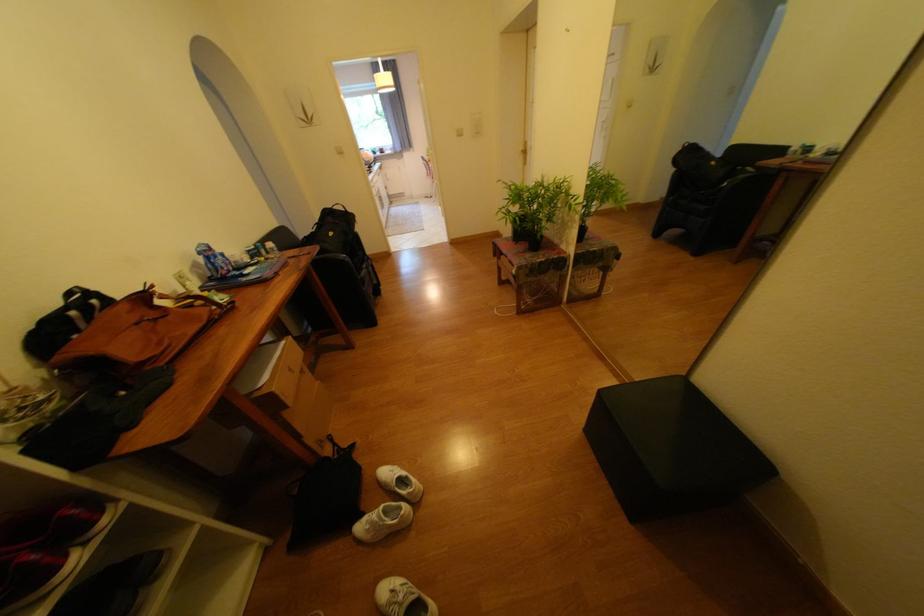
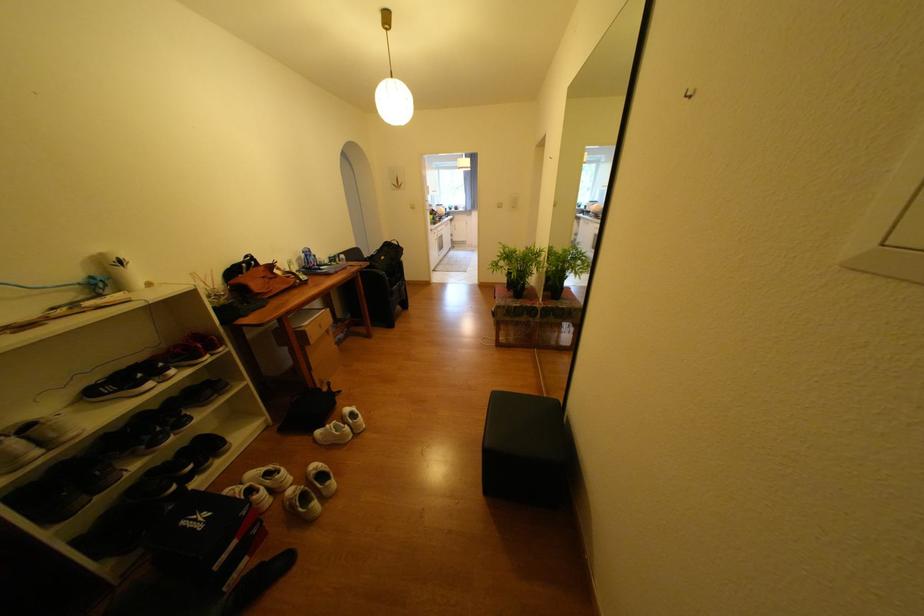
Locate, in the second image, the point that corresponds to (x=210, y=277) in the first image.

(309, 265)